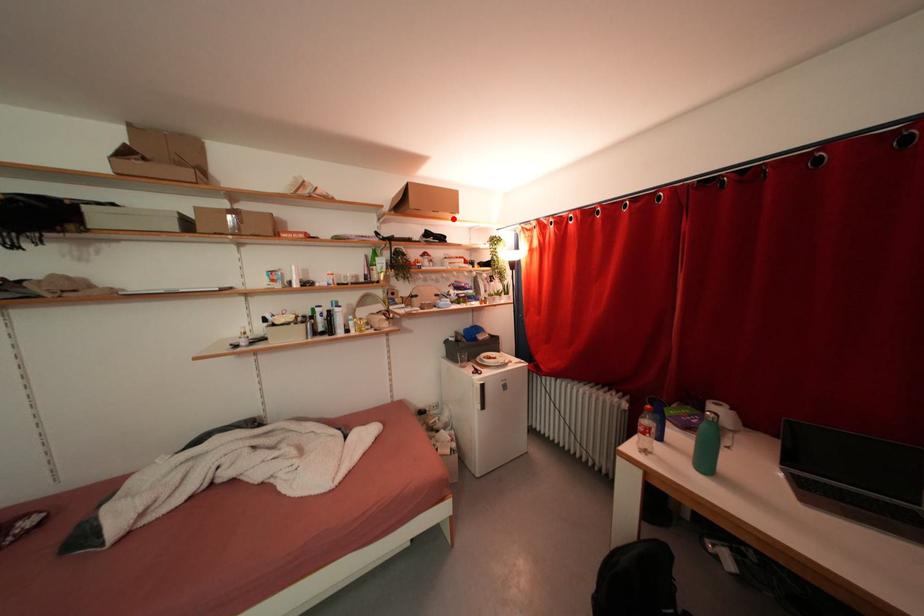
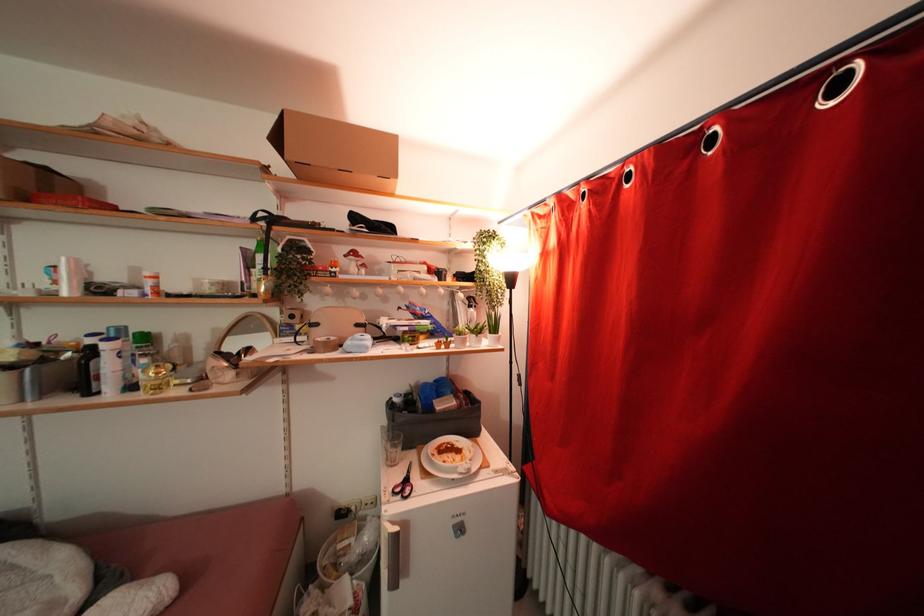
Question: A red point is marked in image1. In image2, is the corresponding 3D point closer to the camera or farther? Reply with the corresponding letter.

Choices:
 (A) The corresponding 3D point is closer.
 (B) The corresponding 3D point is farther.

Answer: (B)